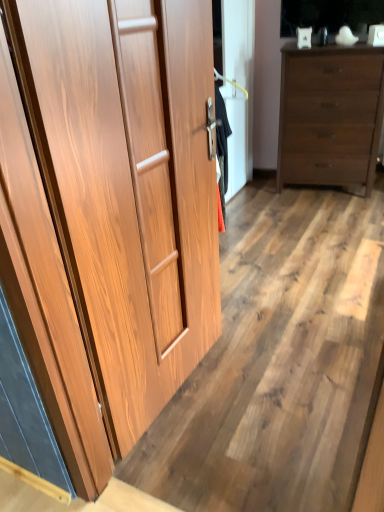
This screenshot has width=384, height=512. In order to click on free region under wooden cupboard at left (from a real-world perspective) in this screenshot , I will do (182, 385).